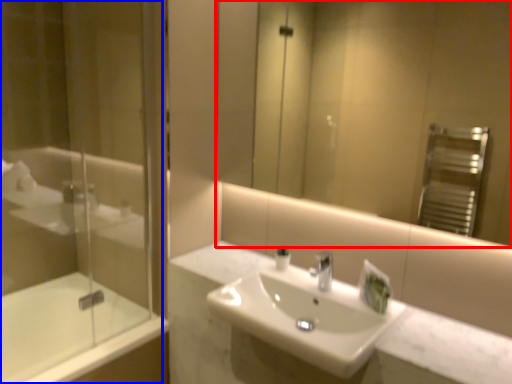
Question: Among these objects, which one is nearest to the camera, mirror (highlighted by a red box) or shower door (highlighted by a blue box)?

Choices:
 (A) mirror
 (B) shower door

Answer: (A)